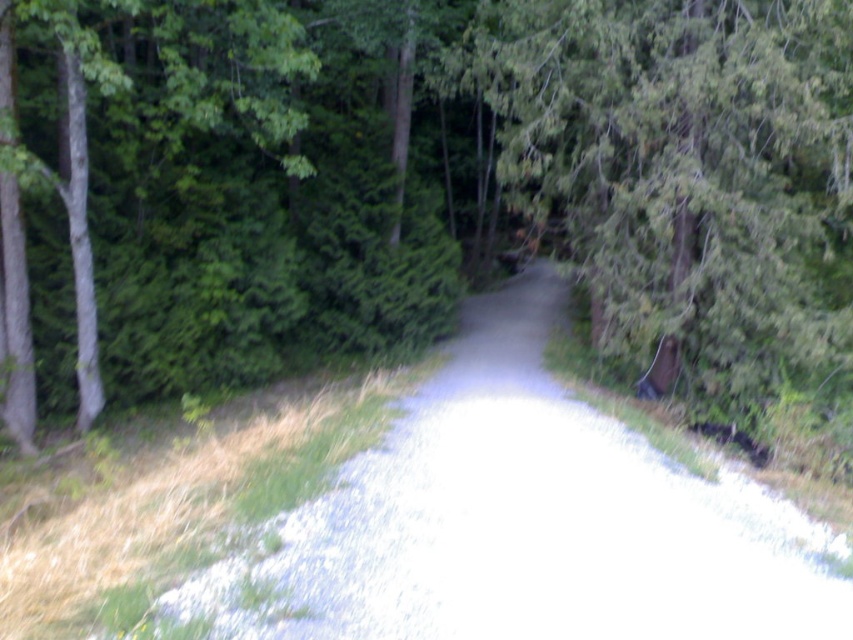
Does green leafy forest at center have a lesser height compared to green textured tree at center?

In fact, green leafy forest at center may be taller than green textured tree at center.

Which of these two, green leafy forest at center or green textured tree at center, stands shorter?

green textured tree at center is shorter.

Is point (309, 176) positioned after point (726, 246)?

Yes.

I want to click on green leafy forest at center, so click(433, 182).

Measure the distance between gray gravel trail at center and green matte tree at left.

gray gravel trail at center and green matte tree at left are 24.93 feet apart.

Is point (303, 547) positioned after point (206, 10)?

No, (303, 547) is closer to viewer.

Is point (647, 504) positioned after point (86, 154)?

No, (647, 504) is closer to viewer.

I want to click on gray gravel trail at center, so click(531, 522).

Between gray gravel trail at center and green textured tree at center, which one is positioned higher?

green textured tree at center is above.

Between point (416, 493) and point (701, 228), which one is positioned behind?

The point (701, 228) is more distant.

Does point (635, 532) lie in front of point (619, 24)?

Yes, it is in front of point (619, 24).

At what (x,y) coordinates should I click in order to perform the action: click on gray gravel trail at center. Please return your answer as a coordinate pair (x, y). Looking at the image, I should click on (531, 522).